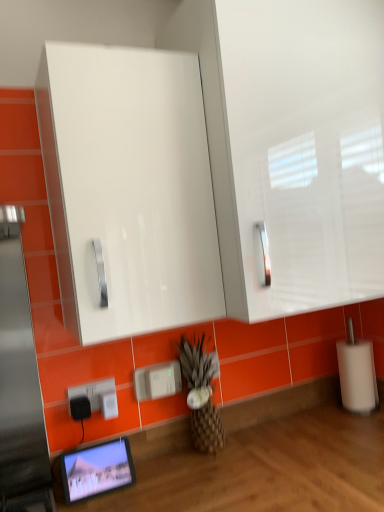
Question: In the image, is white plastic electric outlet at lower left, which is the third electric outlet in left-to-right order, on the left side or the right side of white glossy cabinet at upper center?

Choices:
 (A) left
 (B) right

Answer: (A)

Question: Considering the positions of point (107, 406) and point (102, 181), is point (107, 406) closer or farther from the camera than point (102, 181)?

Choices:
 (A) farther
 (B) closer

Answer: (A)

Question: Which is nearer to the matte black tablet at lower left?

Choices:
 (A) burlap textured pineapple at center
 (B) black plastic electric outlet at lower left, which is the 4th electric outlet from right to left
 (C) white plastic electric outlet at lower left, which is the third electric outlet in left-to-right order
 (D) white plastic charger at lower center, the 4th electric outlet in the left-to-right sequence
 (E) white glossy cabinet at upper center

Answer: (B)

Question: Estimate the real-world distances between objects in this image. Which object is closer to the white glossy cabinet at upper center?

Choices:
 (A) white plastic electric outlet at lower left, which is the third electric outlet in left-to-right order
 (B) black plastic electric outlet at lower left, which is the 4th electric outlet from right to left
 (C) burlap textured pineapple at center
 (D) white plastic charger at lower center, the 4th electric outlet in the left-to-right sequence
 (E) matte black tablet at lower left

Answer: (C)